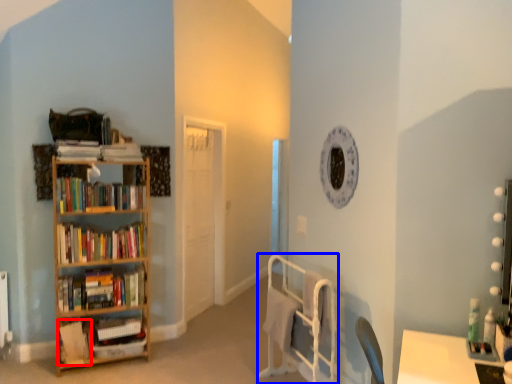
Question: Which of the following is the closest to the observer, book (highlighted by a red box) or bed frame (highlighted by a blue box)?

Choices:
 (A) book
 (B) bed frame

Answer: (B)